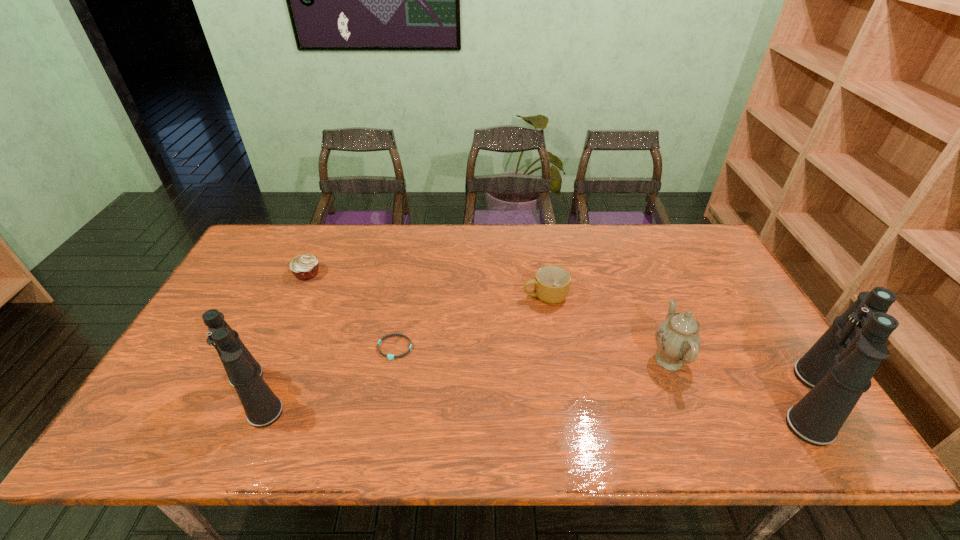
Locate an element on the screen. The width and height of the screenshot is (960, 540). vacant point located between the mug and the fifth shortest object is located at coordinates (400, 345).

Identify which object is located as the fifth nearest to the second object from right to left. Please provide its 2D coordinates. Your answer should be formatted as a tuple, i.e. [(x, y)], where the tuple contains the x and y coordinates of a point satisfying the conditions above.

[(304, 267)]

Image resolution: width=960 pixels, height=540 pixels. In order to click on the fourth closest object to the fourth shortest object in this screenshot , I will do `click(262, 407)`.

The image size is (960, 540). I want to click on vacant position in the image that satisfies the following two spatial constraints: 1. on the spout of the rightmost object; 2. on the right side of the chinaware, so click(685, 401).

Locate an element on the screen. The image size is (960, 540). vacant area in the image that satisfies the following two spatial constraints: 1. on the back side of the taller binoculars; 2. on the spout of the third tallest object is located at coordinates (785, 360).